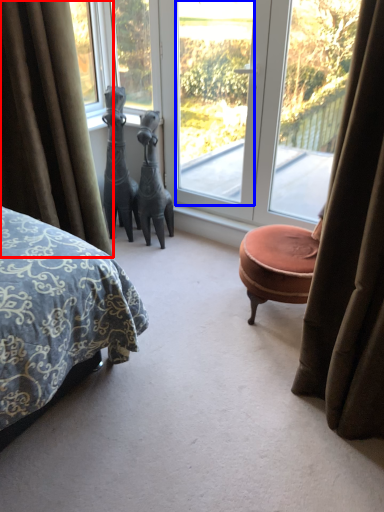
Question: Which point is further to the camera, curtain (highlighted by a red box) or window screen (highlighted by a blue box)?

Choices:
 (A) curtain
 (B) window screen

Answer: (B)